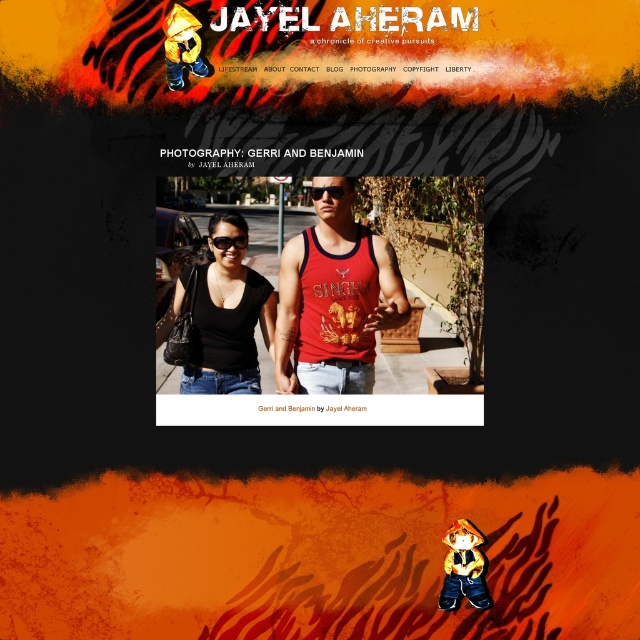
Question: Is red cotton singh vest at center to the right of black plastic sunglasses at center from the viewer's perspective?

Choices:
 (A) yes
 (B) no

Answer: (A)

Question: Which of the following is the farthest from the observer?

Choices:
 (A) black plastic sunglasses at center
 (B) matte red tank top at center
 (C) black plastic goggles at center

Answer: (B)

Question: Among these points, which one is nearest to the camera?

Choices:
 (A) tap(349, 200)
 (B) tap(339, 332)
 (C) tap(323, 188)
 (D) tap(218, 244)

Answer: (D)

Question: Which object is closer to the camera taking this photo?

Choices:
 (A) matte red tank top at center
 (B) red cotton singh vest at center
 (C) black plastic sunglasses at center

Answer: (C)

Question: Considering the relative positions of red cotton singh vest at center and black plastic sunglasses at center in the image provided, where is red cotton singh vest at center located with respect to black plastic sunglasses at center?

Choices:
 (A) right
 (B) left

Answer: (A)

Question: Can you confirm if matte red tank top at center is positioned to the right of red cotton singh vest at center?

Choices:
 (A) no
 (B) yes

Answer: (B)